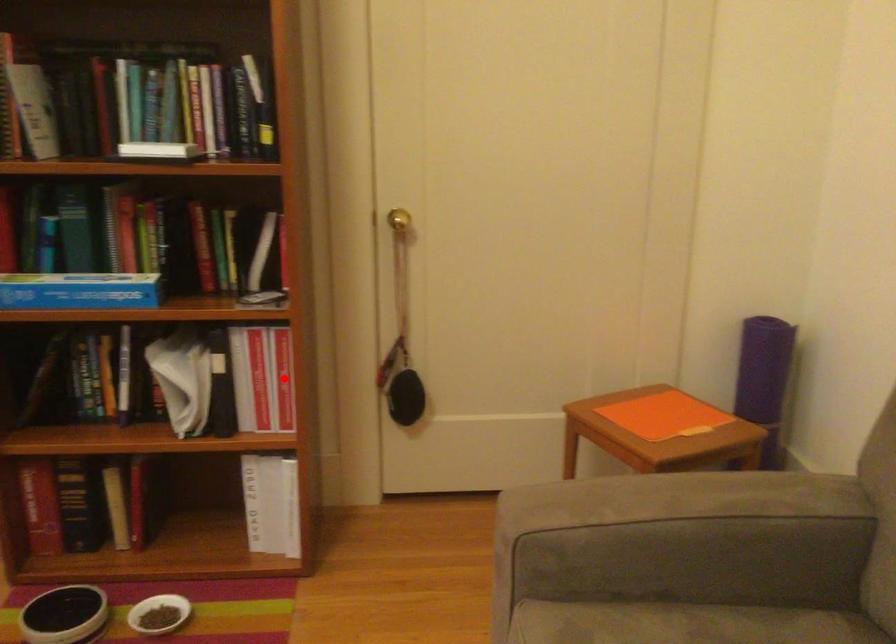
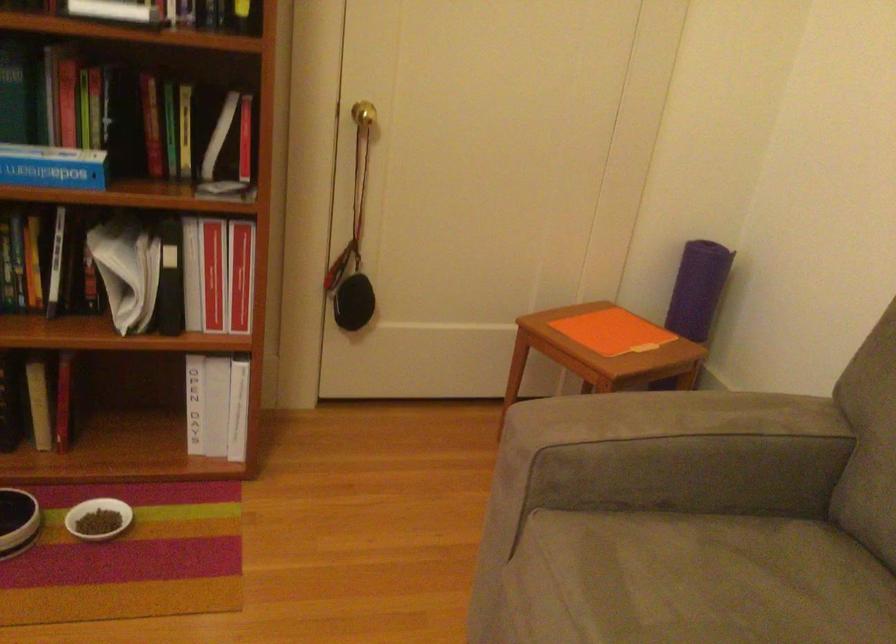
Find the pixel in the second image that matches the highlighted location in the first image.

(239, 275)